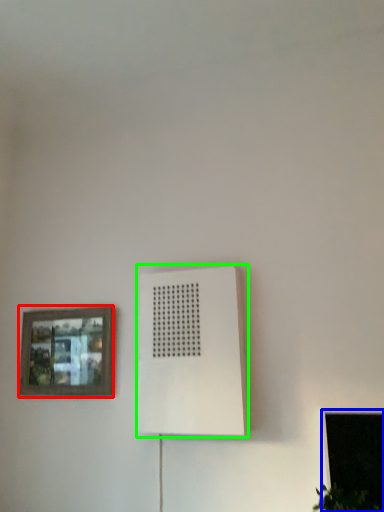
Question: Considering the real-world distances, which object is closest to picture frame (highlighted by a red box)? window (highlighted by a blue box) or air conditioning (highlighted by a green box).

Choices:
 (A) window
 (B) air conditioning

Answer: (B)